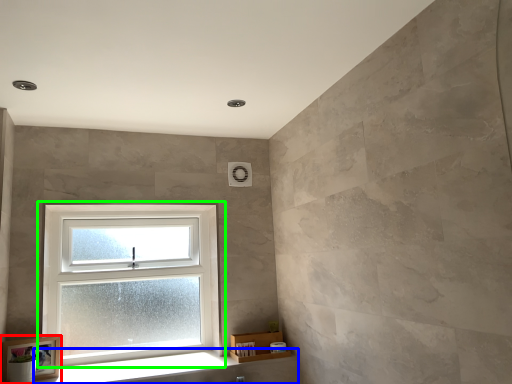
Question: Which object is positioned farthest from picture frame (highlighted by a red box)? Select from window sill (highlighted by a blue box) and window (highlighted by a green box).

Choices:
 (A) window sill
 (B) window

Answer: (B)